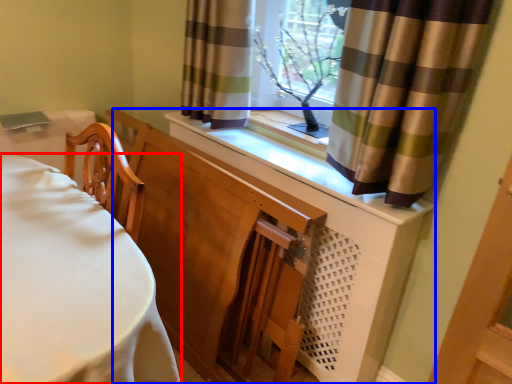
Question: Among these objects, which one is farthest to the camera, furniture (highlighted by a red box) or dresser (highlighted by a blue box)?

Choices:
 (A) furniture
 (B) dresser

Answer: (B)